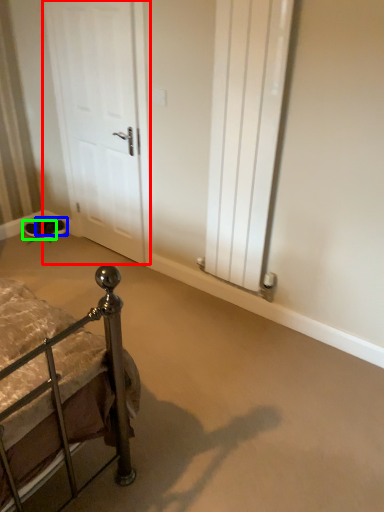
Question: Which object is positioned farthest from door (highlighted by a red box)? Select from footwear (highlighted by a blue box) and footwear (highlighted by a green box).

Choices:
 (A) footwear
 (B) footwear

Answer: (B)